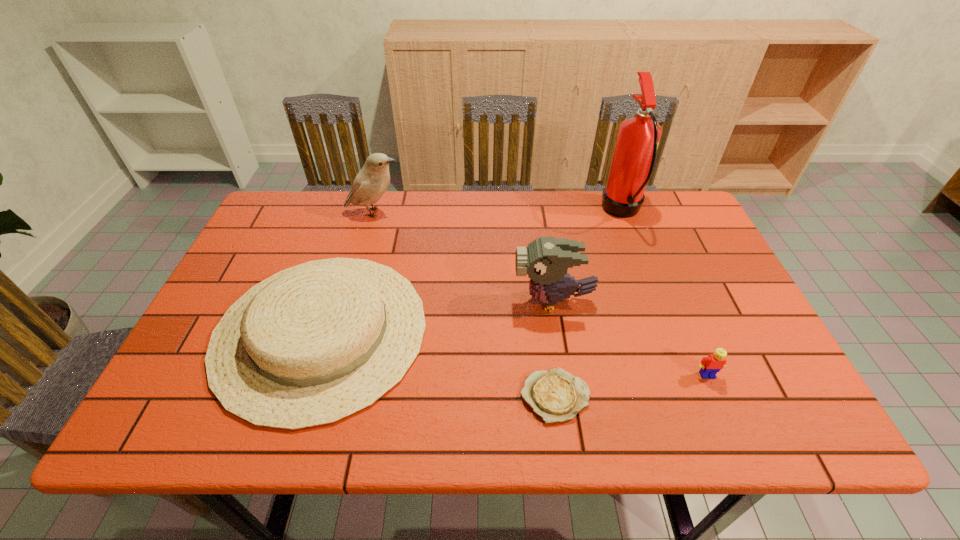
Identify the location of the fourth closest object to the shortest object. This screenshot has height=540, width=960. (634, 156).

Where is `free space in the image that satisfies the following two spatial constraints: 1. at the beak of the left bird; 2. on the back side of the shortest object`? Image resolution: width=960 pixels, height=540 pixels. free space in the image that satisfies the following two spatial constraints: 1. at the beak of the left bird; 2. on the back side of the shortest object is located at coordinates pos(323,396).

I want to click on vacant space that satisfies the following two spatial constraints: 1. at the spray nozzle of the fire extinguisher; 2. on the front side of the sunhat, so click(667, 332).

Where is `vacant space that satisfies the following two spatial constraints: 1. on the back side of the quiche; 2. at the beak of the farther bird`? Image resolution: width=960 pixels, height=540 pixels. vacant space that satisfies the following two spatial constraints: 1. on the back side of the quiche; 2. at the beak of the farther bird is located at coordinates (531, 212).